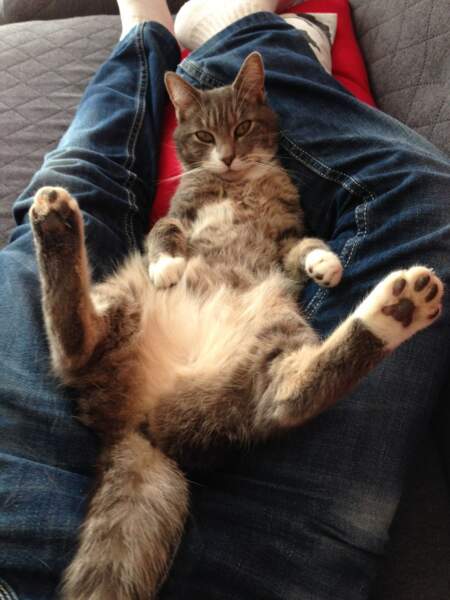
Image resolution: width=450 pixels, height=600 pixels. Identify the location of the left white sock. (143, 8).